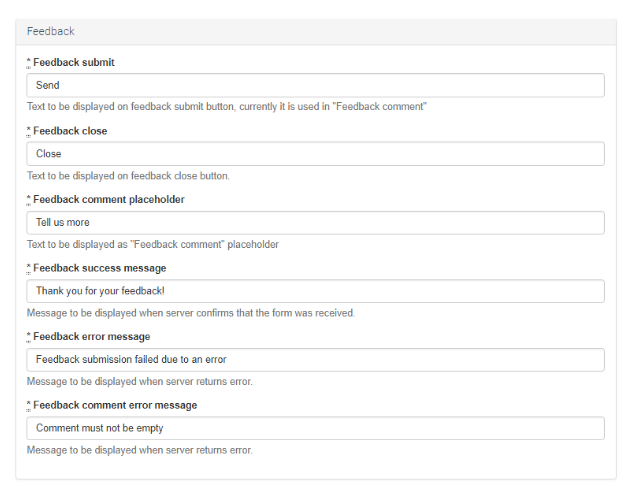
Locate an element on the screen. bar 1 is located at coordinates click(x=210, y=149).